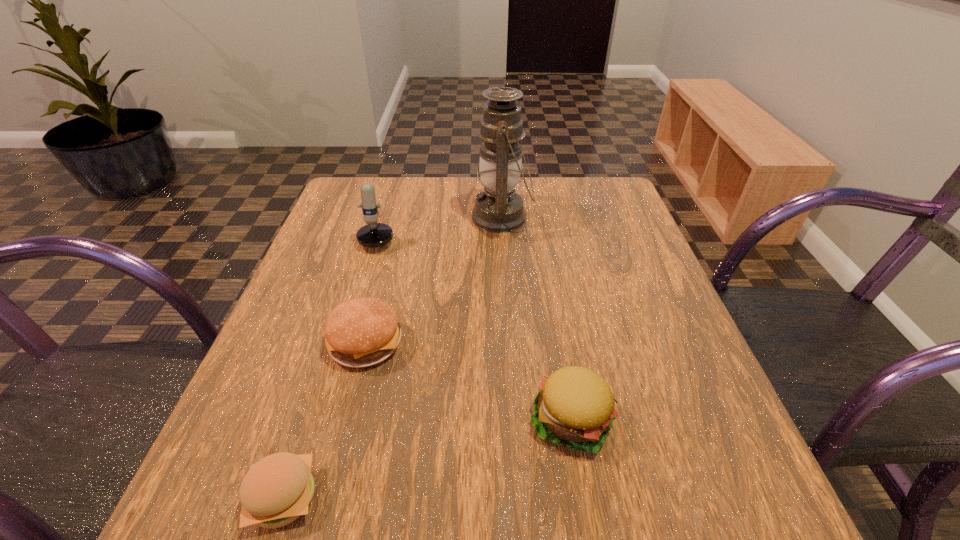
What are the coordinates of `vacant space in between the third nearest object and the microphone` in the screenshot? It's located at (373, 286).

Choose which object is the second nearest neighbor to the nearest object. Please provide its 2D coordinates. Your answer should be formatted as a tuple, i.e. [(x, y)], where the tuple contains the x and y coordinates of a point satisfying the conditions above.

[(575, 406)]

Image resolution: width=960 pixels, height=540 pixels. In order to click on the closest object to the second nearest hamburger in this screenshot , I will do `click(361, 332)`.

I want to click on hamburger that is the closest to the second farthest hamburger, so click(361, 332).

Identify the location of hamburger that is the closest one to the second nearest hamburger. (361, 332).

Where is `free space that satisfies the following two spatial constraints: 1. on the back side of the oil lamp; 2. on the left side of the second tallest object`? free space that satisfies the following two spatial constraints: 1. on the back side of the oil lamp; 2. on the left side of the second tallest object is located at coordinates (384, 218).